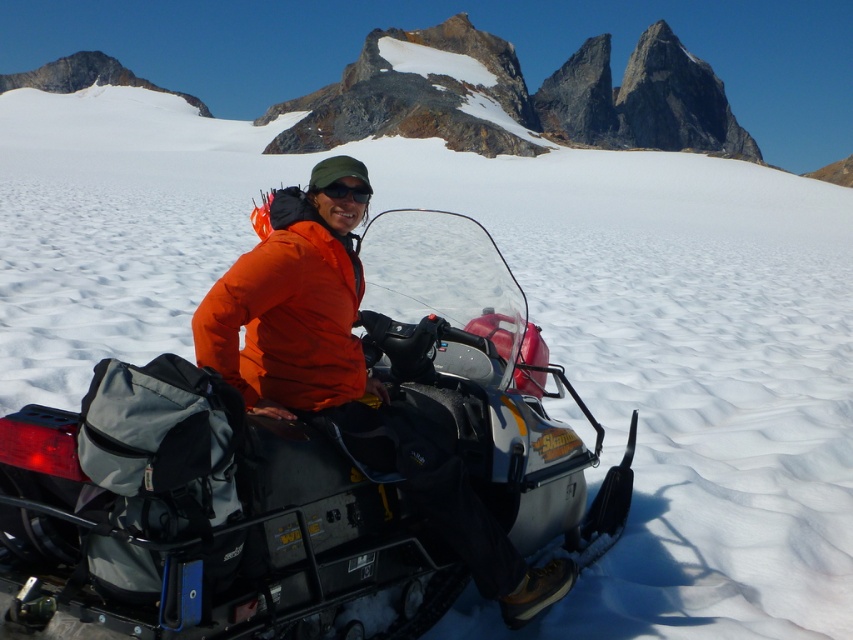
Question: Does matte black snowmobile at center come behind black matte sunglasses at center?

Choices:
 (A) no
 (B) yes

Answer: (A)

Question: Can you confirm if matte black snowmobile at center is positioned above black matte sunglasses at center?

Choices:
 (A) yes
 (B) no

Answer: (B)

Question: Is matte black snowmobile at center further to camera compared to black matte sunglasses at center?

Choices:
 (A) yes
 (B) no

Answer: (B)